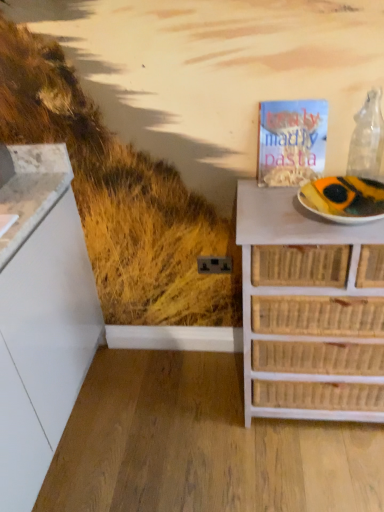
Question: Is white paper plate at right facing away from transparent glass wine bottle at upper right?

Choices:
 (A) no
 (B) yes

Answer: (A)

Question: Are white paper plate at right and transparent glass wine bottle at upper right making contact?

Choices:
 (A) yes
 (B) no

Answer: (B)

Question: Is white paper plate at right bigger than transparent glass wine bottle at upper right?

Choices:
 (A) no
 (B) yes

Answer: (B)

Question: Can you confirm if white paper plate at right is smaller than transparent glass wine bottle at upper right?

Choices:
 (A) no
 (B) yes

Answer: (A)

Question: From a real-world perspective, is white paper plate at right located higher than transparent glass wine bottle at upper right?

Choices:
 (A) yes
 (B) no

Answer: (B)

Question: Visually, is transparent glass wine bottle at upper right positioned to the left or to the right of white paper plate at right?

Choices:
 (A) right
 (B) left

Answer: (A)

Question: From the image's perspective, is transparent glass wine bottle at upper right located above or below white paper plate at right?

Choices:
 (A) above
 (B) below

Answer: (A)

Question: Considering the positions of transparent glass wine bottle at upper right and white paper plate at right in the image, is transparent glass wine bottle at upper right wider or thinner than white paper plate at right?

Choices:
 (A) thin
 (B) wide

Answer: (A)

Question: Is transparent glass wine bottle at upper right in front of or behind white paper plate at right in the image?

Choices:
 (A) front
 (B) behind

Answer: (B)

Question: Is white paper plate at right in front of or behind matte paper magazine at upper right in the image?

Choices:
 (A) front
 (B) behind

Answer: (A)

Question: Do you think white paper plate at right is within matte paper magazine at upper right, or outside of it?

Choices:
 (A) outside
 (B) inside

Answer: (A)

Question: From the image's perspective, is white paper plate at right above or below matte paper magazine at upper right?

Choices:
 (A) above
 (B) below

Answer: (B)

Question: In terms of height, does white paper plate at right look taller or shorter compared to matte paper magazine at upper right?

Choices:
 (A) short
 (B) tall

Answer: (A)

Question: Is white wicker chest of drawers at right to the left or to the right of transparent glass wine bottle at upper right in the image?

Choices:
 (A) right
 (B) left

Answer: (B)

Question: Based on their sizes in the image, would you say white wicker chest of drawers at right is bigger or smaller than transparent glass wine bottle at upper right?

Choices:
 (A) small
 (B) big

Answer: (B)